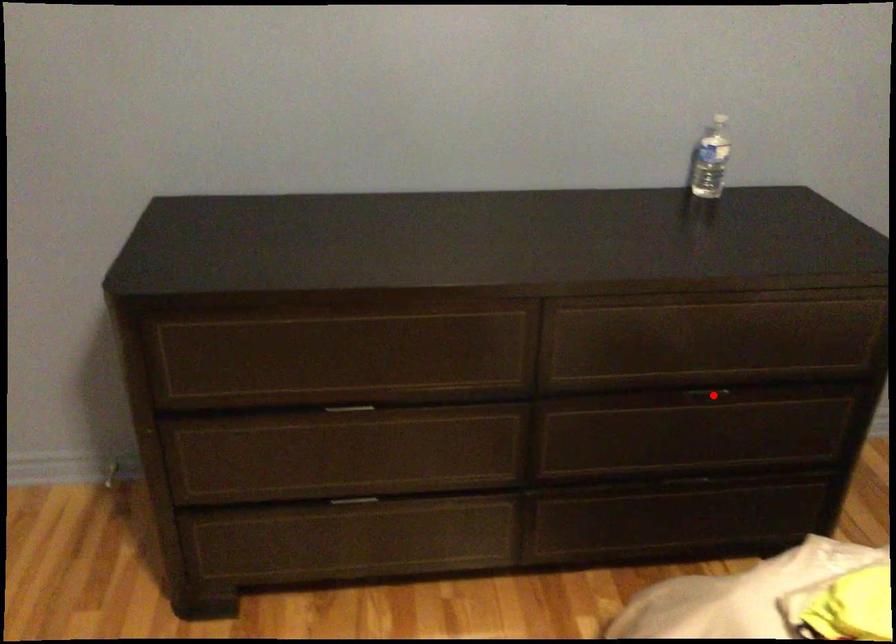
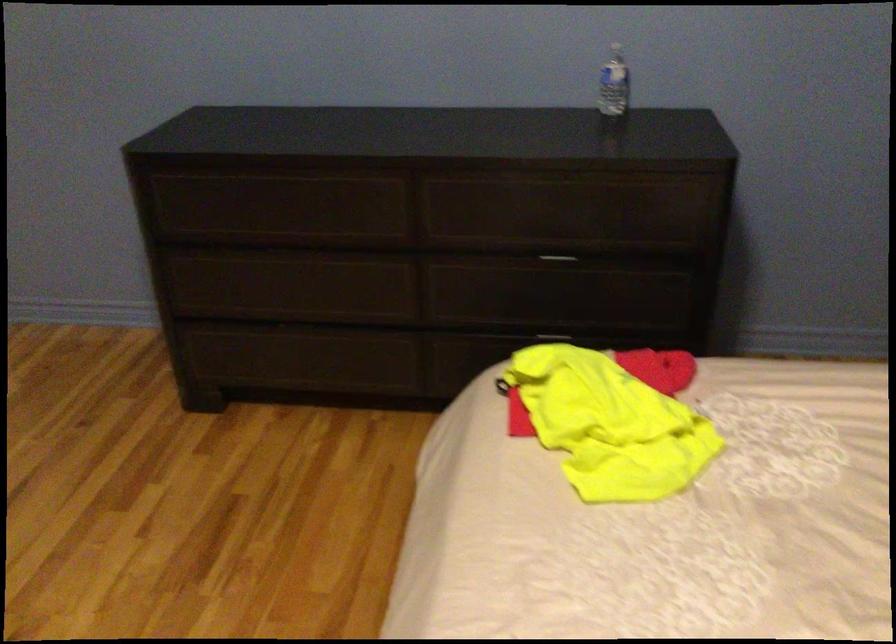
Question: I am providing you with two images of the same scene from different viewpoints. In image1, a red point is highlighted. Considering the same 3D point in image2, which of the following is correct?

Choices:
 (A) It is closer
 (B) It is farther

Answer: (B)